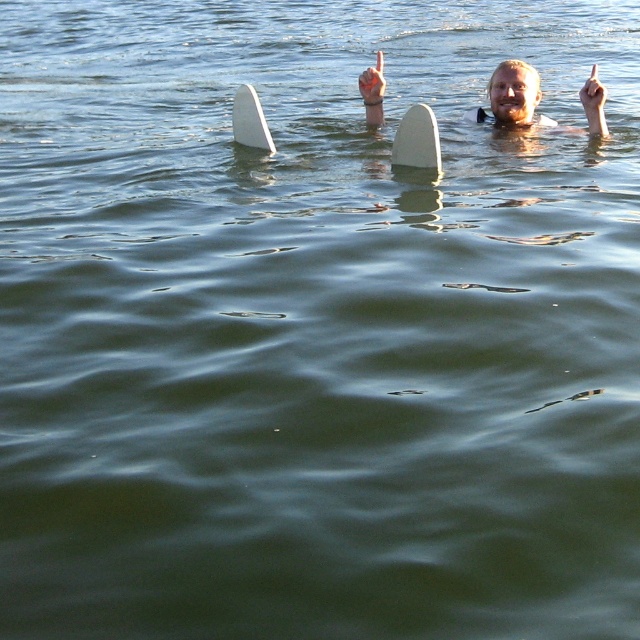
Question: Can you confirm if white matte surfboard at upper center is positioned above white matte hand at upper center?

Choices:
 (A) no
 (B) yes

Answer: (A)

Question: Which of the following is the closest to the observer?

Choices:
 (A) white foam surfboard at center
 (B) white matte surfboard at upper center

Answer: (A)

Question: Can you confirm if white foam surfboard at center is smaller than white matte hand at upper center?

Choices:
 (A) no
 (B) yes

Answer: (B)

Question: Does white foam surfboard at center have a larger size compared to white matte surfboard at upper center?

Choices:
 (A) yes
 (B) no

Answer: (A)

Question: Which point is closer to the camera taking this photo?

Choices:
 (A) (600, 132)
 (B) (380, 88)
 (C) (404, 140)
 (D) (268, 147)

Answer: (C)

Question: Among these objects, which one is nearest to the camera?

Choices:
 (A) smooth white surfboard at upper center
 (B) white matte hand at upper center

Answer: (B)